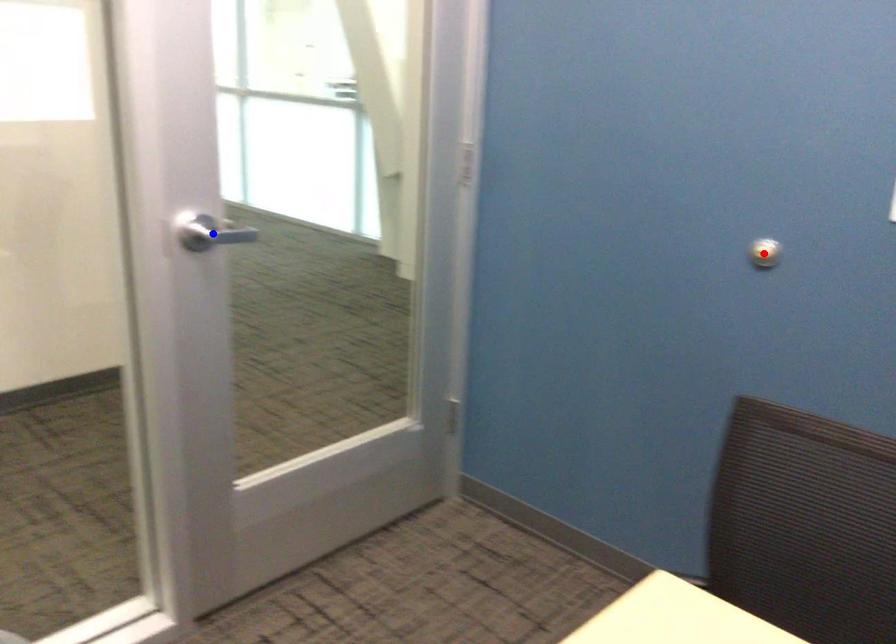
Question: Two points are marked on the image. Which point is closer to the camera?

Choices:
 (A) Blue point is closer.
 (B) Red point is closer.

Answer: (A)